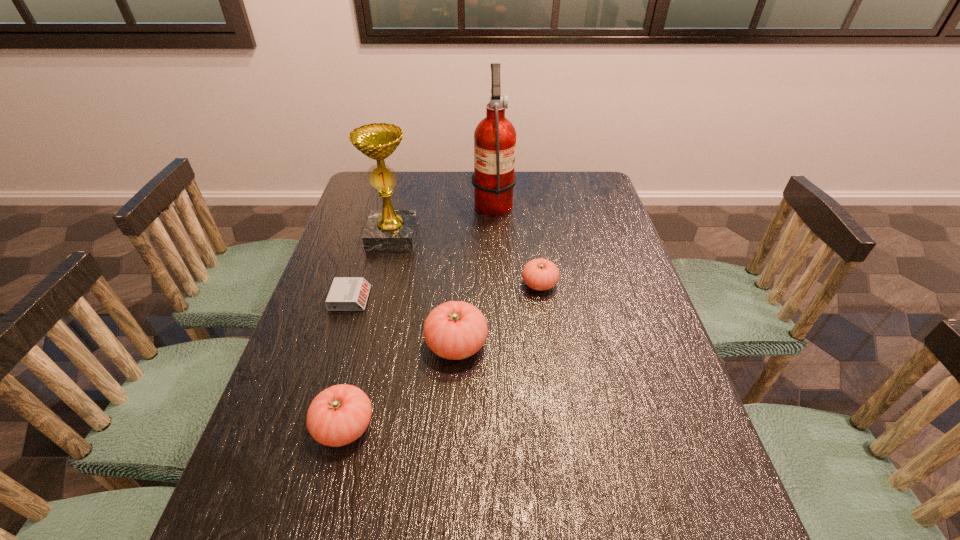
What are the coordinates of `the nearest object` in the screenshot? It's located at (340, 414).

At what (x,y) coordinates should I click in order to perform the action: click on the third shortest object. Please return your answer as a coordinate pair (x, y). This screenshot has height=540, width=960. Looking at the image, I should click on pos(340,414).

Identify the location of the second tomato from right to left. (454, 330).

This screenshot has height=540, width=960. Identify the location of the tallest tomato. (454, 330).

This screenshot has height=540, width=960. In order to click on the shortest tomato in this screenshot , I will do `click(539, 274)`.

Identify the location of the second shortest object. This screenshot has height=540, width=960. (539, 274).

You are a GUI agent. You are given a task and a screenshot of the screen. Output one action in this format:
    pyautogui.click(x=<x>, y=<y>)
    Task: Click on the tallest object
    
    Given the screenshot: What is the action you would take?
    pyautogui.click(x=493, y=179)

This screenshot has width=960, height=540. Find the location of `the farthest object`. the farthest object is located at coordinates (493, 179).

Locate an element on the screen. The width and height of the screenshot is (960, 540). the second farthest object is located at coordinates (388, 229).

Where is `the fifth shortest object`? This screenshot has height=540, width=960. the fifth shortest object is located at coordinates (388, 229).